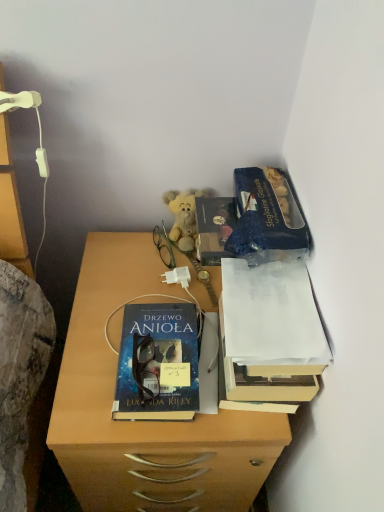
This screenshot has width=384, height=512. In order to click on vacant region in front of green plastic glasses at center in this screenshot , I will do `click(141, 295)`.